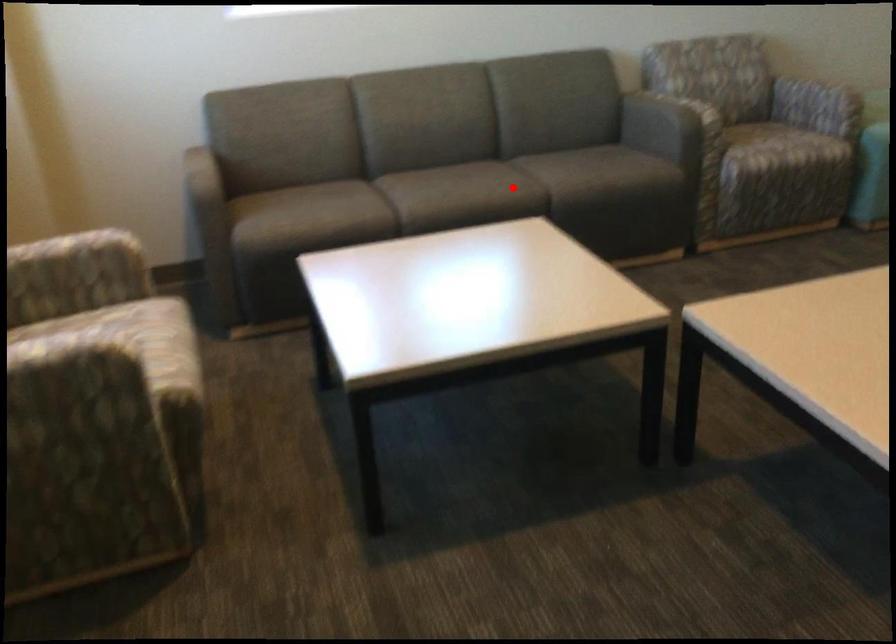
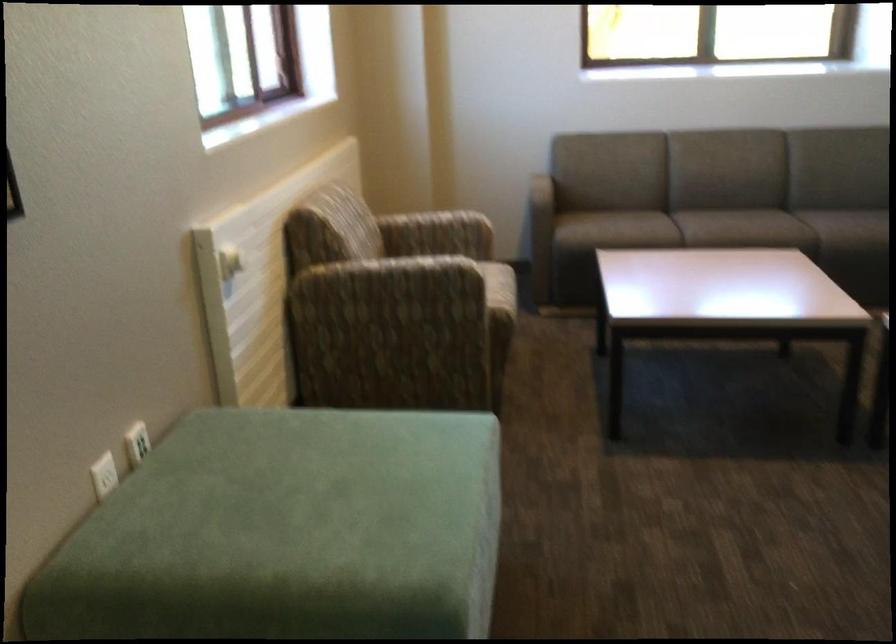
Question: I am providing you with two images of the same scene from different viewpoints. Image1 has a red point marked. In image2, the corresponding 3D location appears at what relative position? Reply with the corresponding letter.

Choices:
 (A) Closer
 (B) Farther

Answer: (B)